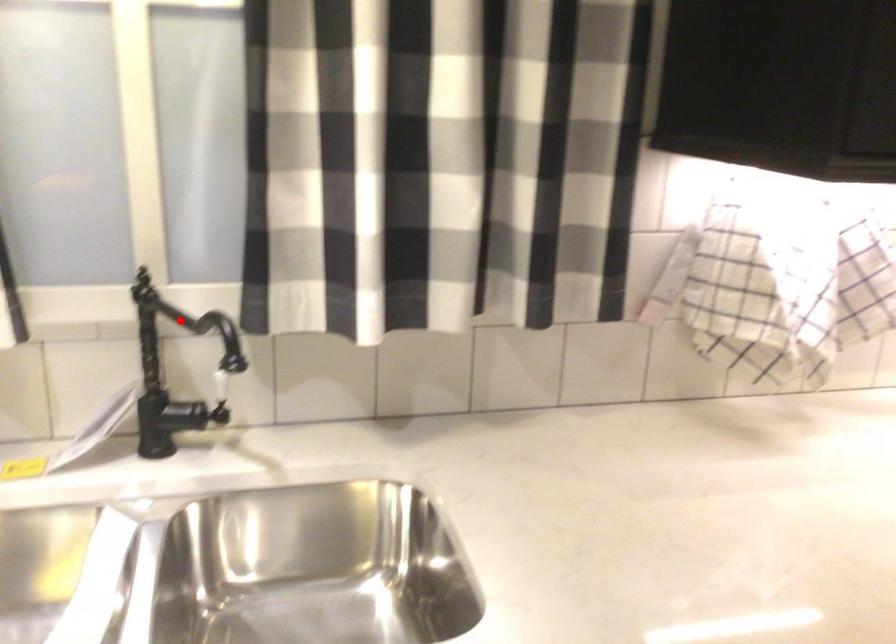
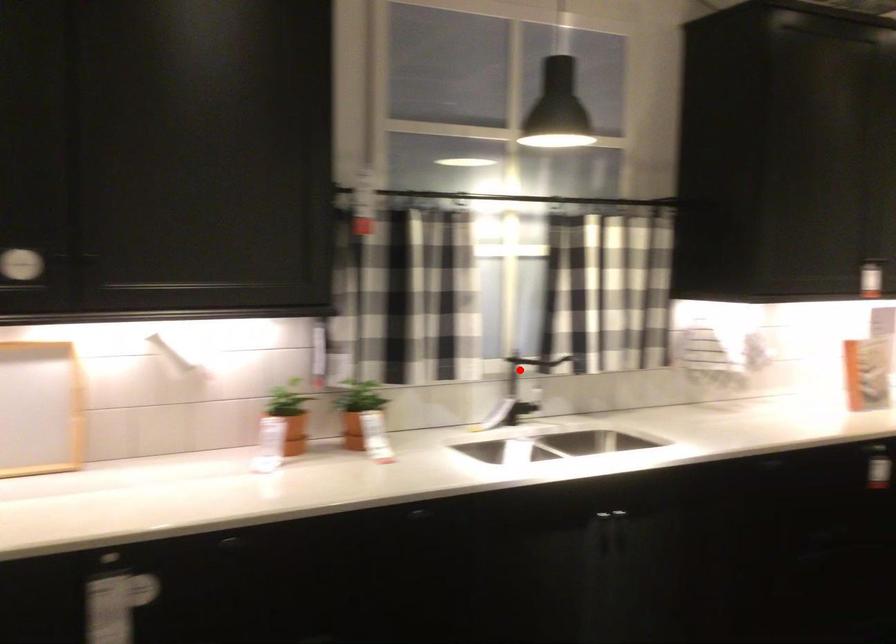
I am providing you with two images of the same scene from different viewpoints. A red point is marked on the first image and another point is marked on the second image. Does the point marked in image1 correspond to the same location as the one in image2?

Yes